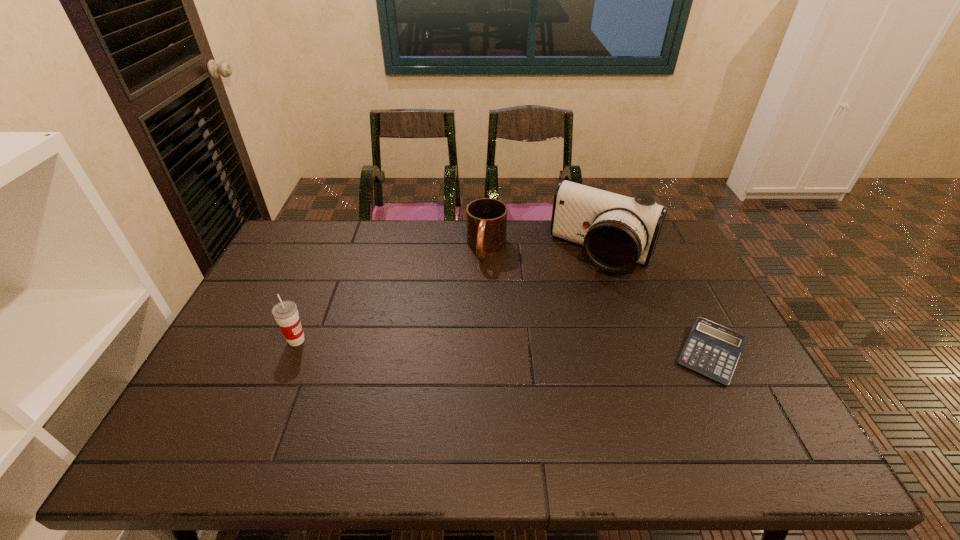
I want to click on free region located 0.140m on the surface of the tallest object, so click(566, 307).

Where is `blank space located on the surface of the tallest object`? The width and height of the screenshot is (960, 540). blank space located on the surface of the tallest object is located at coordinates (542, 346).

You are a GUI agent. You are given a task and a screenshot of the screen. Output one action in this format:
    pyautogui.click(x=<x>, y=<y>)
    Task: Click on the vacant position located 0.170m on the surface of the tallest object
    Image resolution: width=960 pixels, height=540 pixels.
    Given the screenshot: What is the action you would take?
    pyautogui.click(x=563, y=314)

You are a GUI agent. You are given a task and a screenshot of the screen. Output one action in this format:
    pyautogui.click(x=<x>, y=<y>)
    Task: Click on the free spot located 0.140m on the side of the mug with the handle
    
    Given the screenshot: What is the action you would take?
    pyautogui.click(x=475, y=295)

Identify the location of vacant space located on the side of the mug with the handle. (474, 298).

Locate an element on the screen. This screenshot has height=540, width=960. free space located 0.400m on the side of the mug with the handle is located at coordinates (456, 363).

Locate an element on the screen. The width and height of the screenshot is (960, 540). camcorder at the far edge is located at coordinates (616, 231).

Find the location of a particular element. mug that is at the far edge is located at coordinates (486, 218).

Find the location of a particular element. calculator situated at the right edge is located at coordinates (712, 350).

Find the location of `camcorder situated at the right edge`. camcorder situated at the right edge is located at coordinates (616, 231).